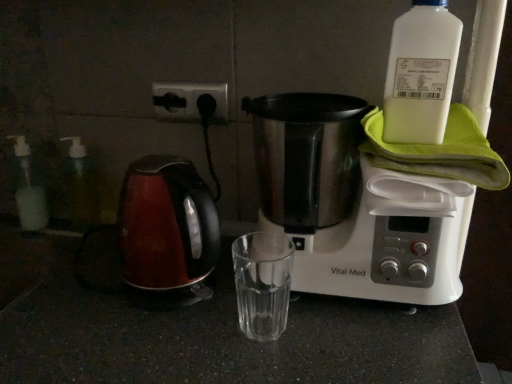
Question: Should I look upward or downward to see black plastic socket at upper center?

Choices:
 (A) down
 (B) up

Answer: (B)

Question: Is transparent plastic bottle at left, the 2th bottle in the right-to-left sequence, located within black plastic socket at upper center?

Choices:
 (A) no
 (B) yes

Answer: (A)

Question: Would you say black plastic socket at upper center is outside transparent plastic bottle at left, the 2th bottle in the right-to-left sequence?

Choices:
 (A) yes
 (B) no

Answer: (A)

Question: Considering the relative sizes of black plastic socket at upper center and transparent plastic bottle at left, positioned as the 2th bottle in left-to-right order, in the image provided, is black plastic socket at upper center shorter than transparent plastic bottle at left, positioned as the 2th bottle in left-to-right order,?

Choices:
 (A) yes
 (B) no

Answer: (A)

Question: Would you say black plastic socket at upper center is a long distance from transparent plastic bottle at left, the 2th bottle positioned from the front?

Choices:
 (A) no
 (B) yes

Answer: (A)

Question: From a real-world perspective, is black plastic socket at upper center on top of transparent plastic bottle at left, positioned as the 2th bottle in left-to-right order?

Choices:
 (A) yes
 (B) no

Answer: (A)

Question: Does black plastic socket at upper center appear on the left side of transparent plastic bottle at left, the 2th bottle positioned from the front?

Choices:
 (A) no
 (B) yes

Answer: (A)

Question: Does shiny red kettle at left have a smaller size compared to translucent plastic soap dispenser at left, the first bottle viewed from the left?

Choices:
 (A) no
 (B) yes

Answer: (A)

Question: Is shiny red kettle at left wider than translucent plastic soap dispenser at left, the 3th bottle positioned from the right?

Choices:
 (A) no
 (B) yes

Answer: (B)

Question: Can translucent plastic soap dispenser at left, the first bottle viewed from the left, be found inside shiny red kettle at left?

Choices:
 (A) yes
 (B) no

Answer: (B)

Question: From a real-world perspective, is shiny red kettle at left beneath translucent plastic soap dispenser at left, which is the 1th bottle in back-to-front order?

Choices:
 (A) yes
 (B) no

Answer: (B)

Question: Are shiny red kettle at left and translucent plastic soap dispenser at left, the third bottle viewed from the front, far apart?

Choices:
 (A) yes
 (B) no

Answer: (B)

Question: Is shiny red kettle at left outside translucent plastic soap dispenser at left, the third bottle viewed from the front?

Choices:
 (A) yes
 (B) no

Answer: (A)

Question: From a real-world perspective, is stainless steel coffee maker at upper right over shiny red kettle at left?

Choices:
 (A) no
 (B) yes

Answer: (B)